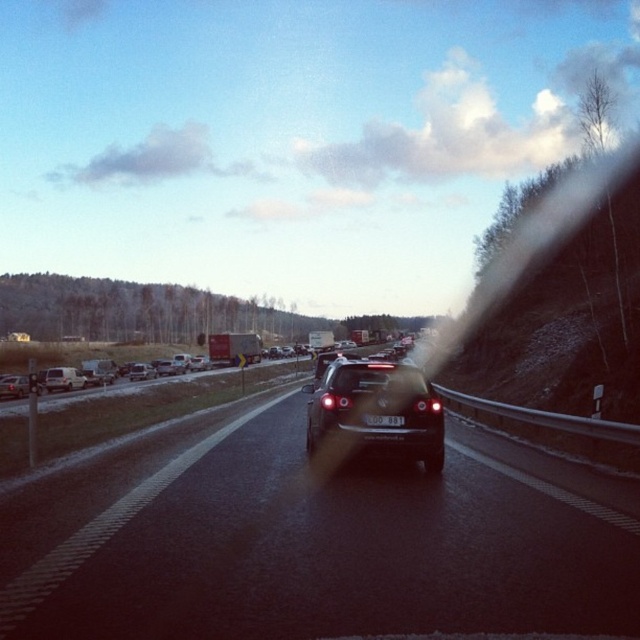
Which of these two, silver metallic van at left or silver metallic sedan at left, stands shorter?

silver metallic sedan at left

Who is more distant from viewer, (58, 369) or (148, 369)?

The point (148, 369) is behind.

Who is more forward, (51, 390) or (138, 365)?

Point (51, 390) is in front.

This screenshot has height=640, width=640. I want to click on silver metallic van at left, so 64,378.

Is satin black car at center further to the viewer compared to silver metallic sedan at left?

That is False.

Between satin black car at center and silver metallic sedan at left, which one has less height?

silver metallic sedan at left is shorter.

This screenshot has height=640, width=640. What do you see at coordinates (376, 410) in the screenshot?
I see `satin black car at center` at bounding box center [376, 410].

Locate an element on the screen. The height and width of the screenshot is (640, 640). satin black car at center is located at coordinates coord(376,410).

Is silver metallic van at left positioned at the back of black plastic license plate at center?

Yes, it is.

Image resolution: width=640 pixels, height=640 pixels. What are the coordinates of `silver metallic van at left` in the screenshot? It's located at (64, 378).

At what (x,y) coordinates should I click in order to perform the action: click on silver metallic van at left. Please return your answer as a coordinate pair (x, y). Looking at the image, I should click on (64, 378).